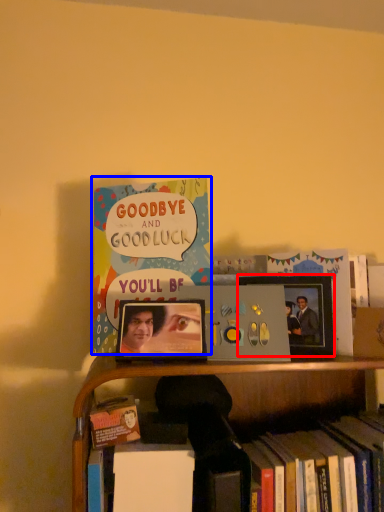
Question: Which object is closer to the camera taking this photo, picture frame (highlighted by a red box) or book (highlighted by a blue box)?

Choices:
 (A) picture frame
 (B) book

Answer: (B)